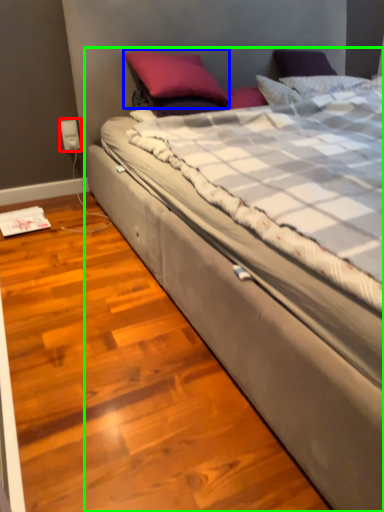
Question: Based on their relative distances, which object is nearer to electric outlet (highlighted by a red box)? Choose from pillow (highlighted by a blue box) and bed (highlighted by a green box).

Choices:
 (A) pillow
 (B) bed

Answer: (A)